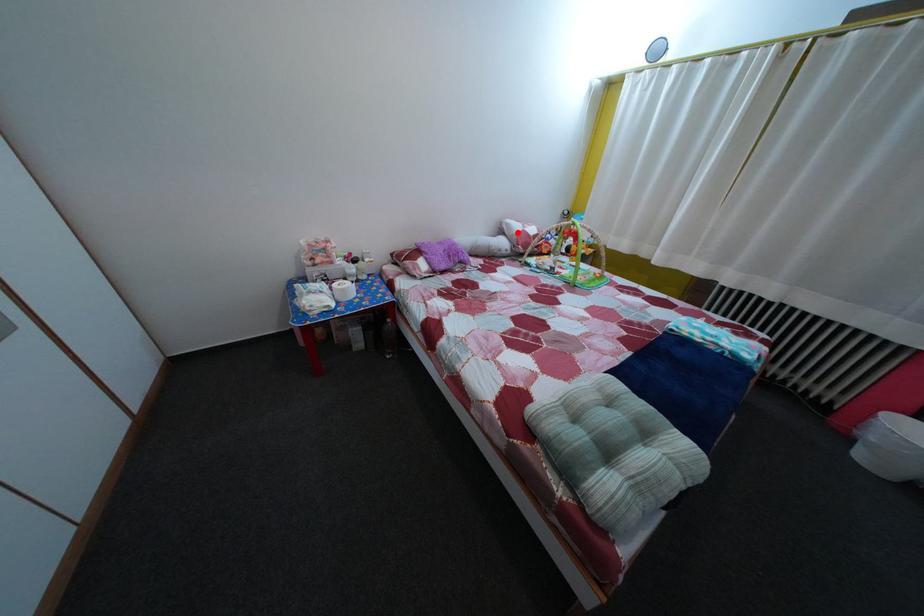
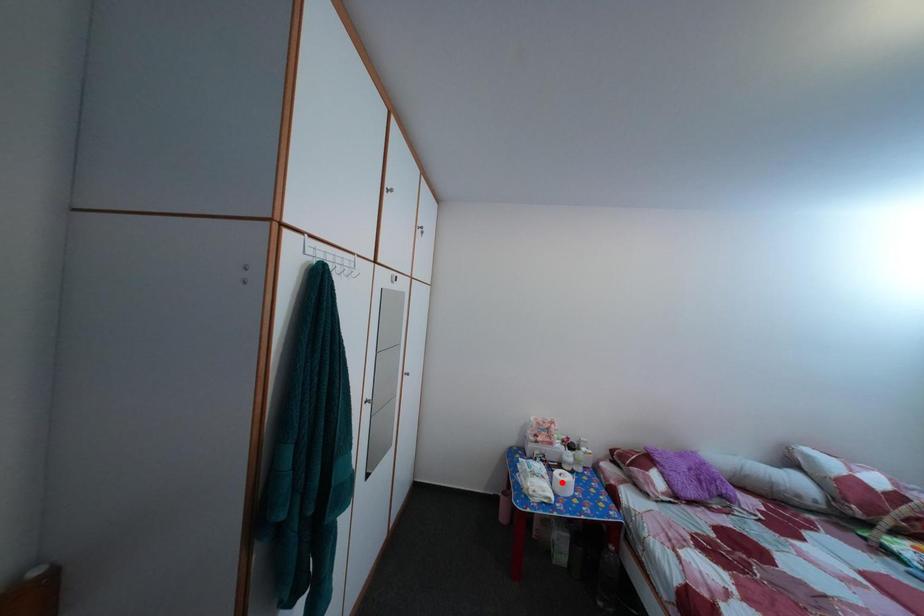
I am providing you with two images of the same scene from different viewpoints. A red point is marked on the first image and another point is marked on the second image. Is the marked point in image1 the same physical position as the marked point in image2?

No